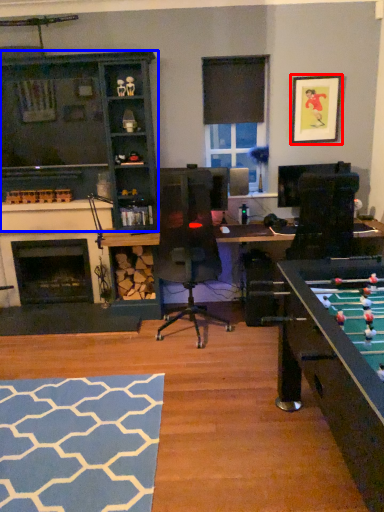
Question: Among these objects, which one is farthest to the camera, picture frame (highlighted by a red box) or cabinetry (highlighted by a blue box)?

Choices:
 (A) picture frame
 (B) cabinetry

Answer: (A)